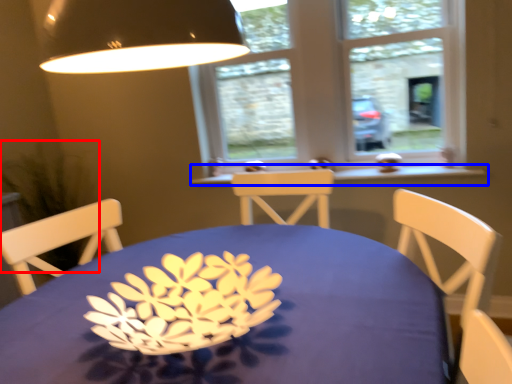
Question: Among these objects, which one is nearest to the camera, plant (highlighted by a red box) or window sill (highlighted by a blue box)?

Choices:
 (A) plant
 (B) window sill

Answer: (A)